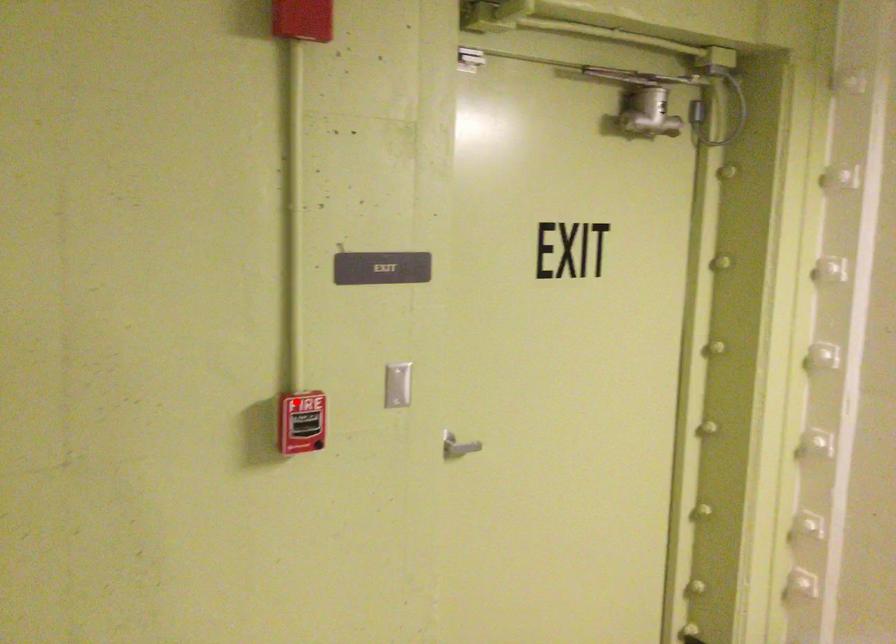
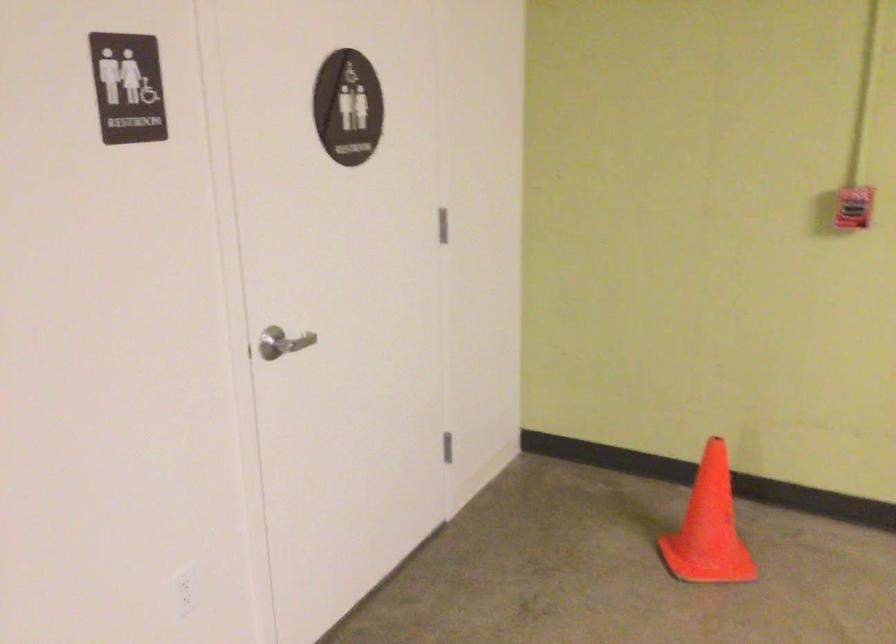
In the second image, find the point that corresponds to the highlighted location in the first image.

(854, 207)